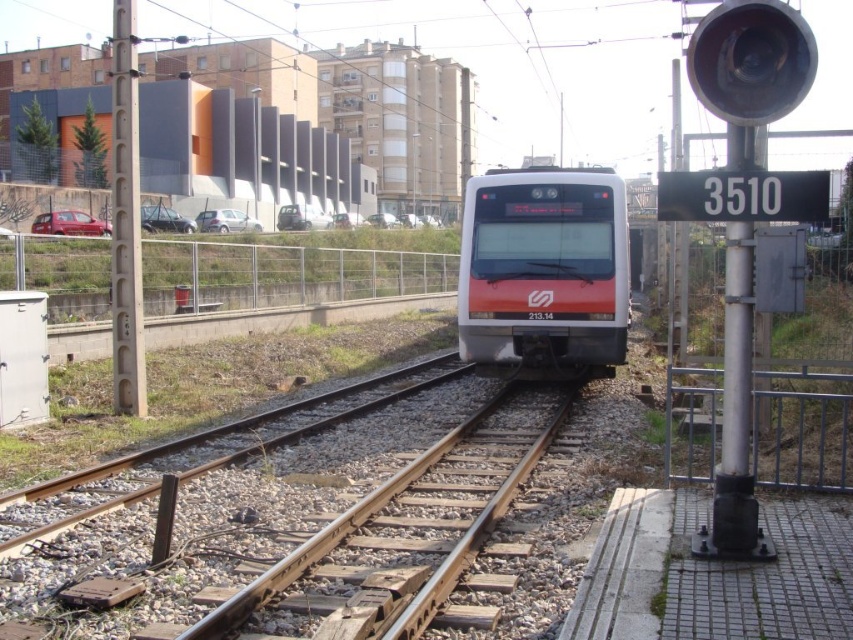
You are a maintenance worker checking the railway infrastructure. You need to determine which object is shorter between the rusty metal train track at center and the smooth gray pole at left. Which one is shorter?

The rusty metal train track at center is shorter than the smooth gray pole at left according to the description.

You are standing at the platform observing the train tracks. There are two points marked on the tracks. The first point is at coordinate point [474,257] and the second is at coordinate point [113,256]. From your perspective, which point is closer to the train as it approaches the platform?

Point [113,256] is closer to the train as it approaches the platform because point [474,257] is behind it.